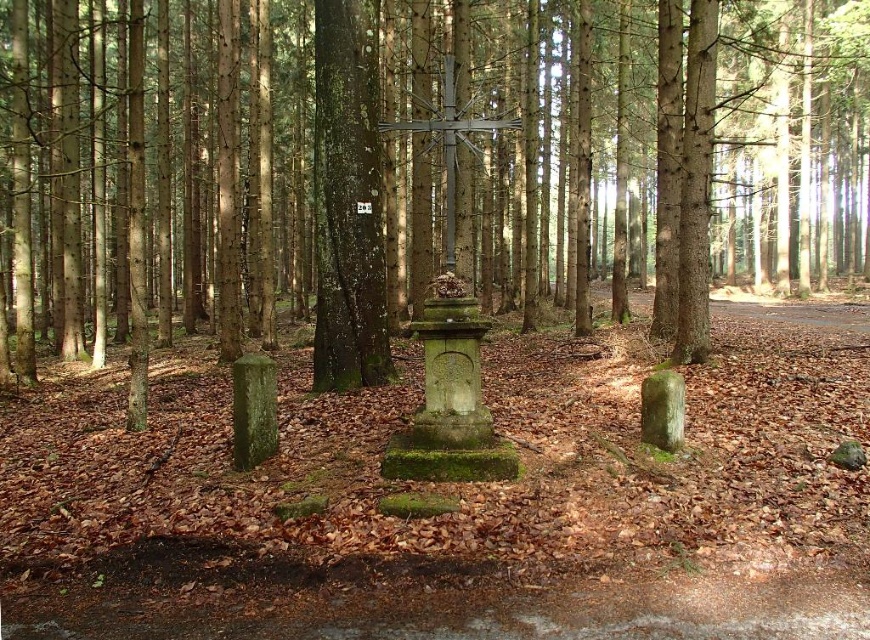
Question: Which object appears closest to the camera in this image?

Choices:
 (A) metallic cross at center
 (B) green mossy tree trunk at center
 (C) green mossy stone cross at center

Answer: (A)

Question: Which object is closer to the camera taking this photo?

Choices:
 (A) green mossy tree trunk at center
 (B) metallic cross at center
 (C) green mossy stone cross at center

Answer: (B)

Question: Is green mossy tree trunk at center to the left of metallic cross at center from the viewer's perspective?

Choices:
 (A) no
 (B) yes

Answer: (B)

Question: Estimate the real-world distances between objects in this image. Which object is farther from the metallic cross at center?

Choices:
 (A) green mossy tree trunk at center
 (B) green mossy stone cross at center

Answer: (B)

Question: Does green mossy tree trunk at center come behind metallic cross at center?

Choices:
 (A) yes
 (B) no

Answer: (A)

Question: Observing the image, what is the correct spatial positioning of green mossy tree trunk at center in reference to metallic cross at center?

Choices:
 (A) right
 (B) left

Answer: (B)